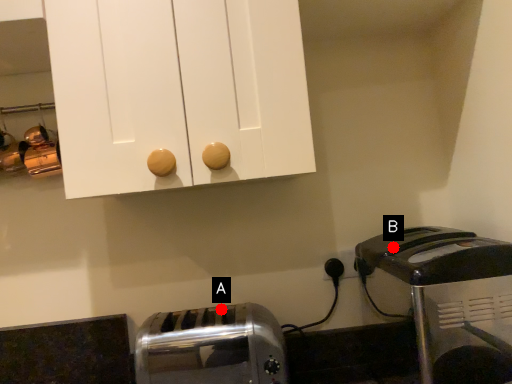
Question: Two points are circled on the image, labeled by A and B beside each circle. Which point is closer to the camera?

Choices:
 (A) A is closer
 (B) B is closer

Answer: (A)